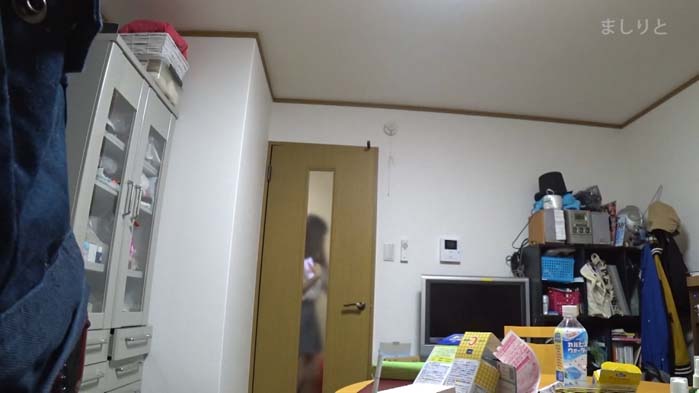
Where is `ceiling`? This screenshot has width=699, height=393. ceiling is located at coordinates (435, 33).